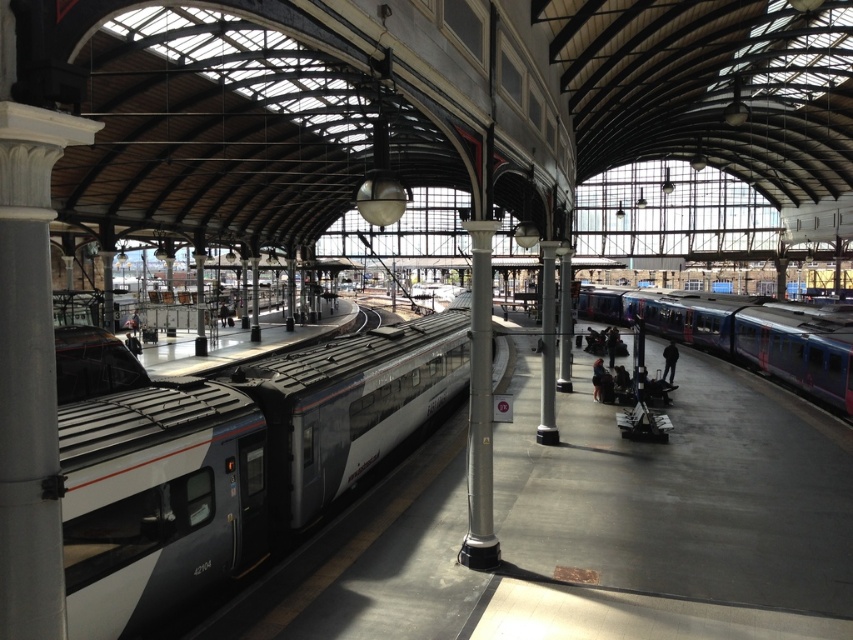
Question: Among these objects, which one is nearest to the camera?

Choices:
 (A) silver metallic train at left
 (B) metallic blue train at right

Answer: (A)

Question: Can you confirm if silver metallic train at left is positioned to the right of dark blue jacket at center?

Choices:
 (A) yes
 (B) no

Answer: (B)

Question: Observing the image, what is the correct spatial positioning of metallic blue train at right in reference to dark blue jeans at center?

Choices:
 (A) right
 (B) left

Answer: (A)

Question: Which object is positioned farthest from the dark blue jacket at center?

Choices:
 (A) metallic blue train at right
 (B) dark blue jeans at center

Answer: (A)

Question: Does dark blue jeans at center have a larger size compared to dark blue jacket at center?

Choices:
 (A) no
 (B) yes

Answer: (B)

Question: Which of these objects is positioned closest to the metallic blue train at right?

Choices:
 (A) silver metallic train at left
 (B) dark blue jacket at center

Answer: (A)